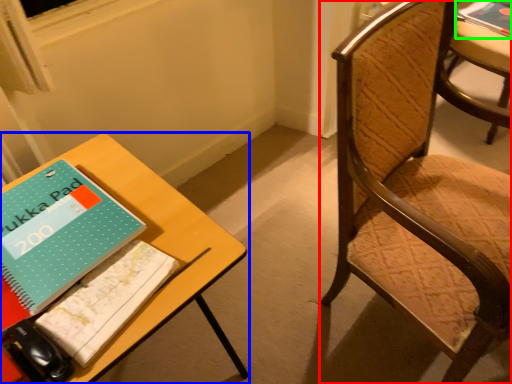
Question: Which object is positioned closest to chair (highlighted by a red box)? Select from table (highlighted by a blue box) and book (highlighted by a green box).

Choices:
 (A) table
 (B) book

Answer: (A)